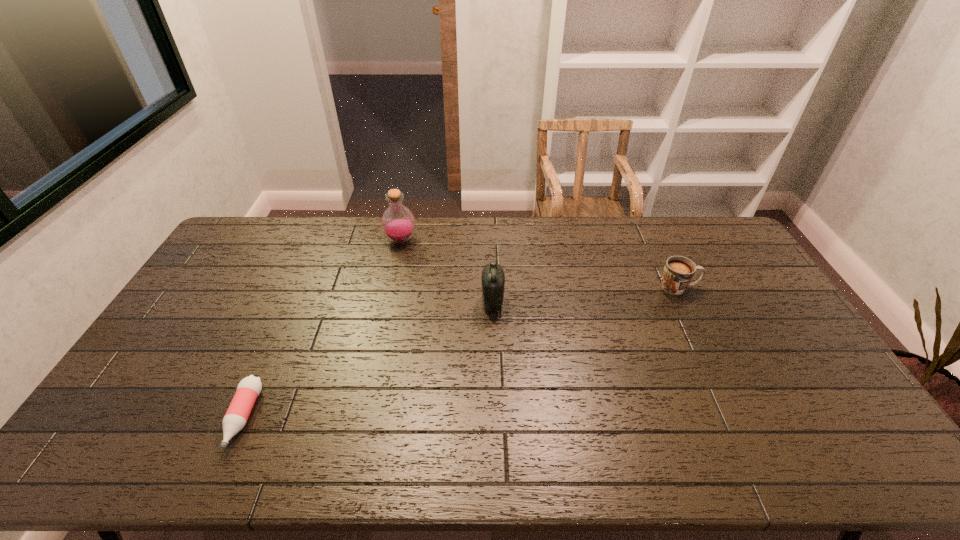
You are a GUI agent. You are given a task and a screenshot of the screen. Output one action in this format:
    pyautogui.click(x=<x>, y=<y>)
    Task: Click on the vacant area situated 0.120m on the side of the rightmost object with the handle
    The width and height of the screenshot is (960, 540).
    Given the screenshot: What is the action you would take?
    pyautogui.click(x=734, y=287)

Locate an element on the screen. This screenshot has width=960, height=540. object that is at the far edge is located at coordinates (398, 223).

You are a GUI agent. You are given a task and a screenshot of the screen. Output one action in this format:
    pyautogui.click(x=<x>, y=<y>)
    Task: Click on the object at the near edge
    Image resolution: width=960 pixels, height=540 pixels.
    Given the screenshot: What is the action you would take?
    pyautogui.click(x=249, y=388)

In the image, there is a desktop. In order to click on vacant space at the far edge in this screenshot , I will do `click(570, 245)`.

This screenshot has height=540, width=960. Identify the location of free space at the near edge of the desktop. (760, 469).

Image resolution: width=960 pixels, height=540 pixels. What are the coordinates of `blank space at the far left corner` in the screenshot? It's located at [x=228, y=249].

At what (x,y) coordinates should I click in order to perform the action: click on vacant space at the far right corner of the desktop. Please return your answer as a coordinate pair (x, y). Looking at the image, I should click on (713, 221).

Locate an element on the screen. empty location between the second tallest bottle and the farthest bottle is located at coordinates (446, 272).

This screenshot has height=540, width=960. In order to click on free space between the leftmost object and the rightmost bottle in this screenshot , I will do `click(368, 360)`.

I want to click on blank region between the leftmost object and the farthest object, so click(323, 329).